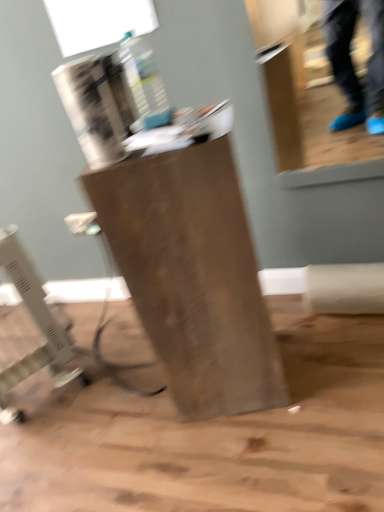
Identify the location of spots to the right of matte brown cabinet at center. (321, 357).